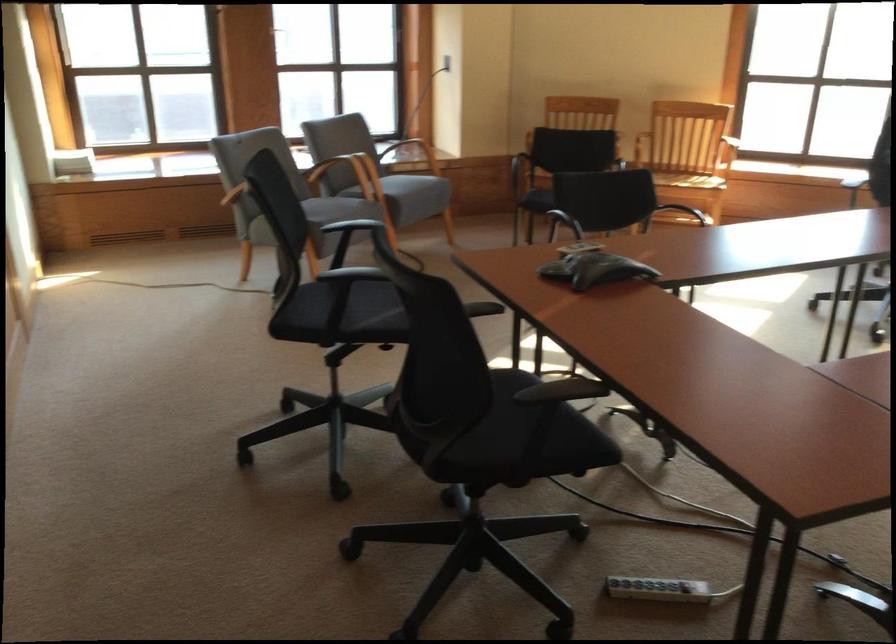
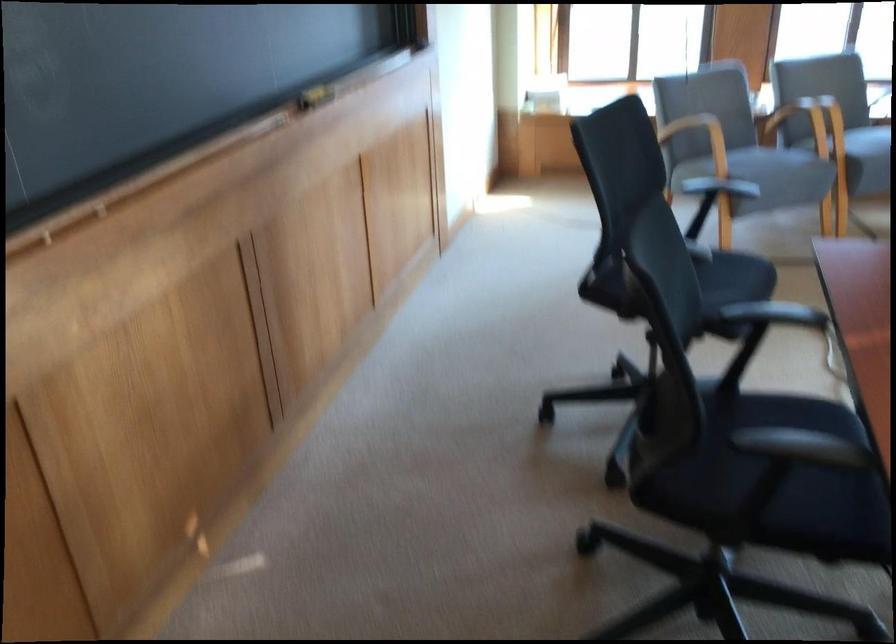
Where in the second image is the point corresponding to point 401,196 from the first image?

(859, 152)